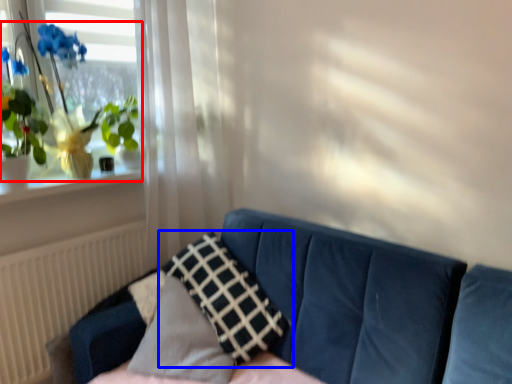
Question: Which object is closer to the camera taking this photo, houseplant (highlighted by a red box) or pillow (highlighted by a blue box)?

Choices:
 (A) houseplant
 (B) pillow

Answer: (B)